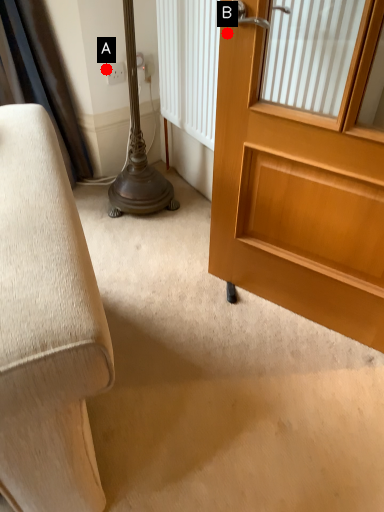
Question: Two points are circled on the image, labeled by A and B beside each circle. Which point is closer to the camera taking this photo?

Choices:
 (A) A is closer
 (B) B is closer

Answer: (B)